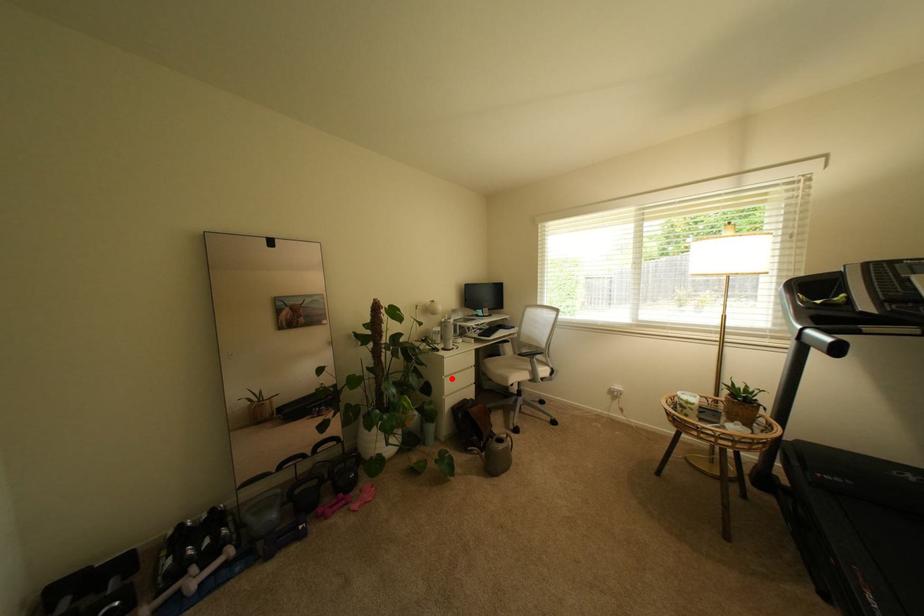
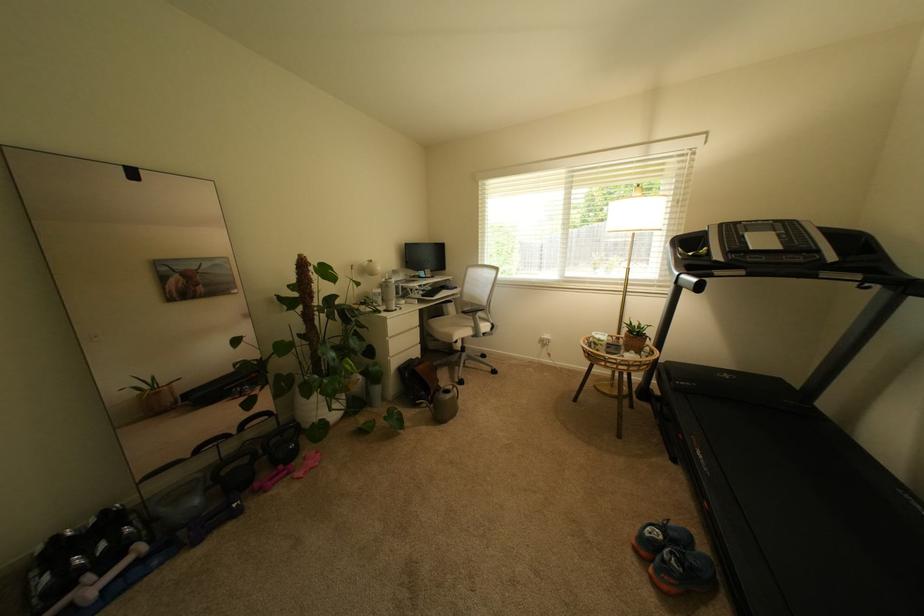
Find the pixel in the second image that matches the highlighted location in the first image.

(395, 339)